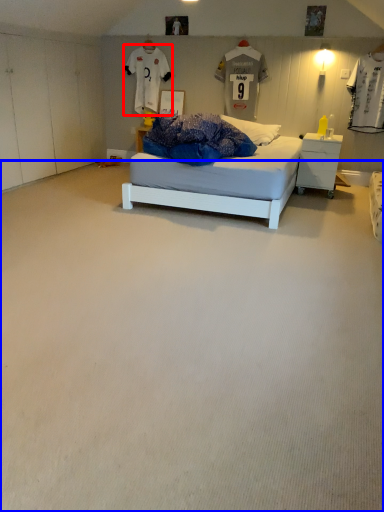
Question: Which object appears closest to the camera in this image, t shirt (highlighted by a red box) or plain (highlighted by a blue box)?

Choices:
 (A) t shirt
 (B) plain

Answer: (B)